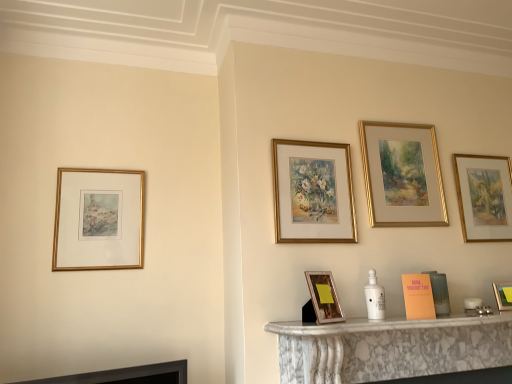
Question: Is gold framed print at left, positioned as the first picture frame in left-to-right order, in front of or behind orange matte book at lower right in the image?

Choices:
 (A) behind
 (B) front

Answer: (A)

Question: Visually, is gold framed print at left, positioned as the first picture frame in left-to-right order, positioned to the left or to the right of orange matte book at lower right?

Choices:
 (A) left
 (B) right

Answer: (A)

Question: Estimate the real-world distances between objects in this image. Which object is closer to the gold-framed painting at upper right, the sixth picture frame when ordered from left to right?

Choices:
 (A) gold/gilded frame at center, the fourth picture frame in the right-to-left sequence
 (B) orange matte book at lower right
 (C) gold-framed painting at upper center, placed as the 3th picture frame when sorted from right to left
 (D) gold framed print at left, positioned as the first picture frame in left-to-right order
 (E) matte gold picture frame at right, acting as the fifth picture frame starting from the left

Answer: (C)

Question: Considering the real-world distances, which object is closest to the gold framed print at left, placed as the 6th picture frame when sorted from right to left?

Choices:
 (A) matte gold picture frame at right, acting as the fifth picture frame starting from the left
 (B) gold/gilded frame at center, marked as the 3th picture frame in a left-to-right arrangement
 (C) wooden picture frame at lower center, marked as the fifth picture frame in a right-to-left arrangement
 (D) orange matte book at lower right
 (E) gold-framed painting at upper center, placed as the 3th picture frame when sorted from right to left

Answer: (B)